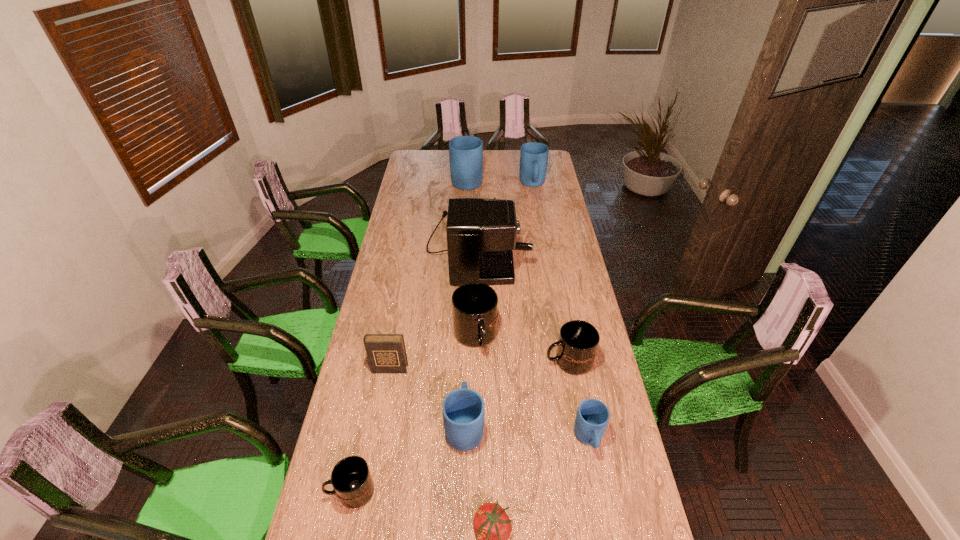
What are the coordinates of `the leftmost mug` in the screenshot? It's located at (351, 479).

This screenshot has width=960, height=540. What are the coordinates of `the leftmost black mug` in the screenshot? It's located at (351, 479).

You are a GUI agent. You are given a task and a screenshot of the screen. Output one action in this format:
    pyautogui.click(x=<x>, y=<y>)
    Task: Click on the free space located on the front-facing side of the tallest object
    This screenshot has width=960, height=540.
    Given the screenshot: What is the action you would take?
    pyautogui.click(x=568, y=247)

Locate an element on the screen. The width and height of the screenshot is (960, 540). vacant space located on the side of the tallest mug with the handle is located at coordinates (468, 151).

At what (x,y) coordinates should I click in order to perform the action: click on vacant space located 0.210m on the side of the tallest mug with the handle. Please return your answer as a coordinate pair (x, y). This screenshot has height=540, width=960. Looking at the image, I should click on (468, 153).

I want to click on free location located 0.200m on the side of the tallest mug with the handle, so click(468, 154).

At what (x,y) coordinates should I click in order to perform the action: click on free location located 0.340m on the side of the second biggest blue mug with the handle. Please return your answer as a coordinate pair (x, y). Looking at the image, I should click on point(540,230).

At what (x,y) coordinates should I click in order to perform the action: click on vacant space positioned with the handle on the side of the second black mug from left to right. Please return your answer as a coordinate pair (x, y). Image resolution: width=960 pixels, height=540 pixels. Looking at the image, I should click on (475, 400).

Locate an element on the screen. free space located 0.120m on the front cover of the diary is located at coordinates (383, 403).

Locate an element on the screen. The image size is (960, 540). vacant space located on the side of the second smallest blue mug with the handle is located at coordinates pos(467,354).